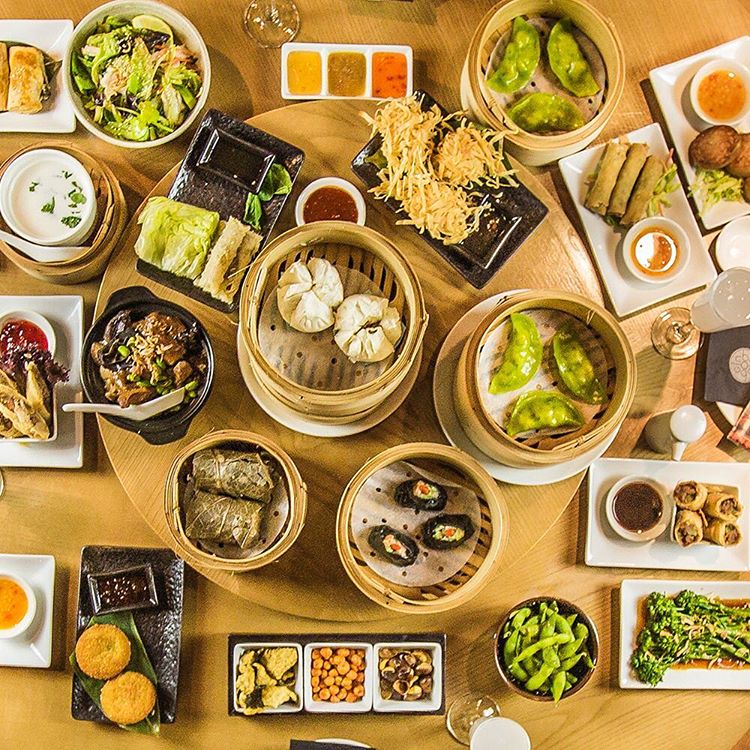
Where is `lazy susan`? lazy susan is located at coordinates (326, 483).